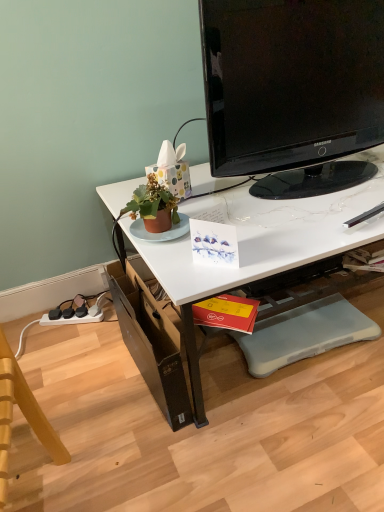
At what (x,y) coordinates should I click in order to perform the action: click on free space in front of black glossy television at upper center. Please return your answer as a coordinate pair (x, y). Looking at the image, I should click on (312, 222).